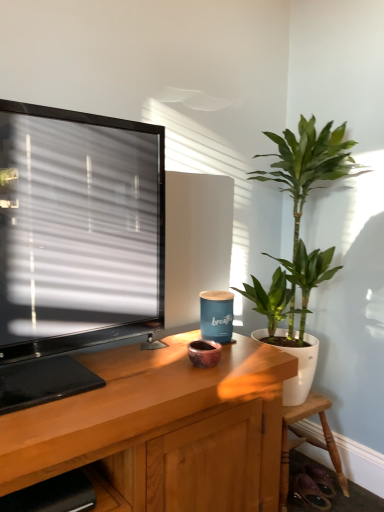
This screenshot has height=512, width=384. Describe the element at coordinates (307, 441) in the screenshot. I see `wooden chair at lower right` at that location.

Identify the location of wooden shelf at lower left. This screenshot has width=384, height=512. (68, 494).

What are the coordinates of `wooden chair at lower right` in the screenshot? It's located at (307, 441).

Can we say green glossy plant at right lies outside wooden chair at lower right?

Yes, green glossy plant at right is outside of wooden chair at lower right.

From the image's perspective, is green glossy plant at right on wooden chair at lower right?

Yes, from the image's perspective, green glossy plant at right is on top of wooden chair at lower right.

Which object is further away from the camera, green glossy plant at right or wooden chair at lower right?

wooden chair at lower right is further from the camera.

Considering the positions of points (303, 177) and (288, 488), is point (303, 177) closer to camera compared to point (288, 488)?

No, it is behind (288, 488).

Which is more to the right, wooden shelf at lower left or wooden chair at lower right?

Positioned to the right is wooden chair at lower right.

Who is bigger, wooden shelf at lower left or wooden chair at lower right?

wooden shelf at lower left.

Considering the sizes of objects wooden shelf at lower left and wooden chair at lower right in the image provided, who is wider, wooden shelf at lower left or wooden chair at lower right?

wooden shelf at lower left.

In the scene shown: Which point is more forward, (31, 489) or (286, 509)?

Positioned in front is point (31, 489).

Does wooden chair at lower right touch green glossy plant at right?

No, wooden chair at lower right is not with green glossy plant at right.

From a real-world perspective, is wooden chair at lower right positioned over green glossy plant at right based on gravity?

No.

From the image's perspective, which is below, wooden chair at lower right or green glossy plant at right?

wooden chair at lower right.

In the scene shown: Is wooden chair at lower right oriented away from green glossy plant at right?

That's not correct — wooden chair at lower right is not looking away from green glossy plant at right.

Between green glossy plant at right and wooden shelf at lower left, which one has less height?

Standing shorter between the two is wooden shelf at lower left.

From a real-world perspective, is green glossy plant at right physically above wooden shelf at lower left?

Yes, from a real-world perspective, green glossy plant at right is on top of wooden shelf at lower left.

Between green glossy plant at right and wooden shelf at lower left, which one has larger width?

green glossy plant at right is wider.

Which point is more distant from viewer, (x=355, y=166) or (x=85, y=490)?

The point (x=355, y=166) is behind.

In the scene shown: Would you consider wooden chair at lower right to be distant from wooden shelf at lower left?

That's not correct — wooden chair at lower right is a little close to wooden shelf at lower left.

At what (x,y) coordinates should I click in order to perform the action: click on chair below the wooden shelf at lower left (from a real-world perspective). Please return your answer as a coordinate pair (x, y). The width and height of the screenshot is (384, 512). Looking at the image, I should click on (307, 441).

Is wooden chair at lower right located outside wooden shelf at lower left?

Absolutely, wooden chair at lower right is external to wooden shelf at lower left.

Which object is further away from the camera, wooden chair at lower right or wooden shelf at lower left?

wooden chair at lower right.

Considering the positions of points (50, 507) and (302, 169), is point (50, 507) farther from camera compared to point (302, 169)?

No.

How different are the orientations of wooden shelf at lower left and green glossy plant at right in degrees?

0.52 degrees.

Is wooden shelf at lower left to the left of green glossy plant at right from the viewer's perspective?

Yes, wooden shelf at lower left is to the left of green glossy plant at right.

You are a GUI agent. You are given a task and a screenshot of the screen. Output one action in this format:
    pyautogui.click(x=<x>, y=<y>)
    Task: Click on the chair below the green glossy plant at right (from a real-world perspective)
    
    Given the screenshot: What is the action you would take?
    pyautogui.click(x=307, y=441)

In the image, there is a wooden chair at lower right. Identify the location of shelf above it (from the image's perspective). This screenshot has width=384, height=512. (68, 494).

When comparing their distances from green glossy plant at right, does wooden shelf at lower left or wooden chair at lower right seem further?

wooden shelf at lower left is further to green glossy plant at right.

When comparing their distances from wooden chair at lower right, does green glossy plant at right or wooden shelf at lower left seem further?

wooden shelf at lower left lies further to wooden chair at lower right than the other object.

Based on their spatial positions, is wooden chair at lower right or wooden shelf at lower left closer to green glossy plant at right?

Based on the image, wooden chair at lower right appears to be nearer to green glossy plant at right.

Looking at this image, considering their positions, is wooden chair at lower right positioned closer to wooden shelf at lower left than green glossy plant at right?

wooden chair at lower right.

From the image, which object appears to be nearer to wooden chair at lower right, wooden shelf at lower left or green glossy plant at right?

green glossy plant at right.

From the image, which object appears to be farther from wooden shelf at lower left, green glossy plant at right or wooden chair at lower right?

Based on the image, green glossy plant at right appears to be further to wooden shelf at lower left.

Identify the location of houseplant situated between wooden shelf at lower left and wooden chair at lower right from left to right. (301, 216).